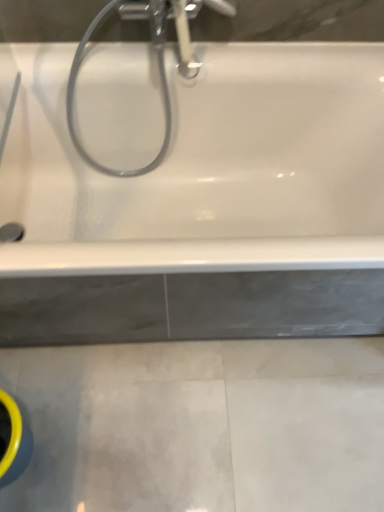
Question: Is white glossy bathtub at upper center far from satin nickel faucet at upper center?

Choices:
 (A) yes
 (B) no

Answer: (B)

Question: Is white glossy bathtub at upper center positioned before satin nickel faucet at upper center?

Choices:
 (A) no
 (B) yes

Answer: (B)

Question: Does white glossy bathtub at upper center lie behind satin nickel faucet at upper center?

Choices:
 (A) yes
 (B) no

Answer: (B)

Question: From the image's perspective, is white glossy bathtub at upper center below satin nickel faucet at upper center?

Choices:
 (A) yes
 (B) no

Answer: (A)

Question: Would you say satin nickel faucet at upper center is part of white glossy bathtub at upper center's contents?

Choices:
 (A) no
 (B) yes

Answer: (A)

Question: Considering the positions of white glossy bathtub at upper center and satin nickel faucet at upper center in the image, is white glossy bathtub at upper center wider or thinner than satin nickel faucet at upper center?

Choices:
 (A) thin
 (B) wide

Answer: (B)

Question: Choose the correct answer: Is white glossy bathtub at upper center inside satin nickel faucet at upper center or outside it?

Choices:
 (A) inside
 (B) outside

Answer: (B)

Question: From the image's perspective, relative to satin nickel faucet at upper center, is white glossy bathtub at upper center above or below?

Choices:
 (A) below
 (B) above

Answer: (A)

Question: From a real-world perspective, is white glossy bathtub at upper center positioned above or below satin nickel faucet at upper center?

Choices:
 (A) below
 (B) above

Answer: (A)

Question: In terms of height, does satin nickel faucet at upper center look taller or shorter compared to chrome metallic showerhead at upper center?

Choices:
 (A) tall
 (B) short

Answer: (B)

Question: From the image's perspective, is satin nickel faucet at upper center above or below chrome metallic showerhead at upper center?

Choices:
 (A) below
 (B) above

Answer: (B)

Question: In terms of width, does satin nickel faucet at upper center look wider or thinner when compared to chrome metallic showerhead at upper center?

Choices:
 (A) thin
 (B) wide

Answer: (B)

Question: In terms of size, does satin nickel faucet at upper center appear bigger or smaller than chrome metallic showerhead at upper center?

Choices:
 (A) small
 (B) big

Answer: (A)

Question: From the image's perspective, relative to satin nickel faucet at upper center, is chrome metallic showerhead at upper center above or below?

Choices:
 (A) below
 (B) above

Answer: (A)

Question: Is chrome metallic showerhead at upper center bigger or smaller than satin nickel faucet at upper center?

Choices:
 (A) big
 (B) small

Answer: (A)